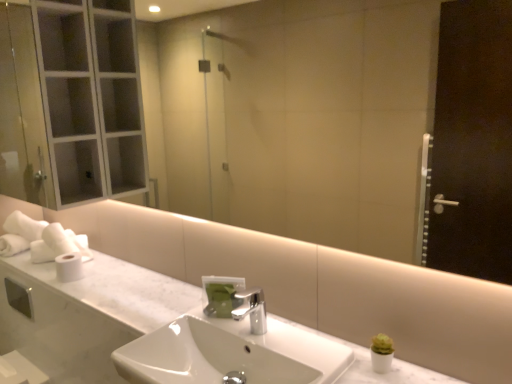
Question: From the image's perspective, is white glossy sink at center positioned above or below polished metallic faucet at center?

Choices:
 (A) below
 (B) above

Answer: (A)

Question: Is white glossy sink at center in front of or behind polished metallic faucet at center in the image?

Choices:
 (A) behind
 (B) front

Answer: (B)

Question: Which of these objects is positioned closest to the white glossy sink at center?

Choices:
 (A) white marble counter top at center
 (B) polished metallic faucet at center
 (C) green matte soap dispenser at center
 (D) white matte toilet paper at left, which ranks as the second toilet paper in back-to-front order
 (E) white matte toilet paper at left, the first toilet paper from the back

Answer: (B)

Question: Which is nearer to the white matte toilet paper at left, marked as the 2th toilet paper in a front-to-back arrangement?

Choices:
 (A) white glossy sink at center
 (B) white matte toilet paper at left, which ranks as the second toilet paper in back-to-front order
 (C) white marble counter top at center
 (D) green matte soap dispenser at center
 (E) polished metallic faucet at center

Answer: (B)